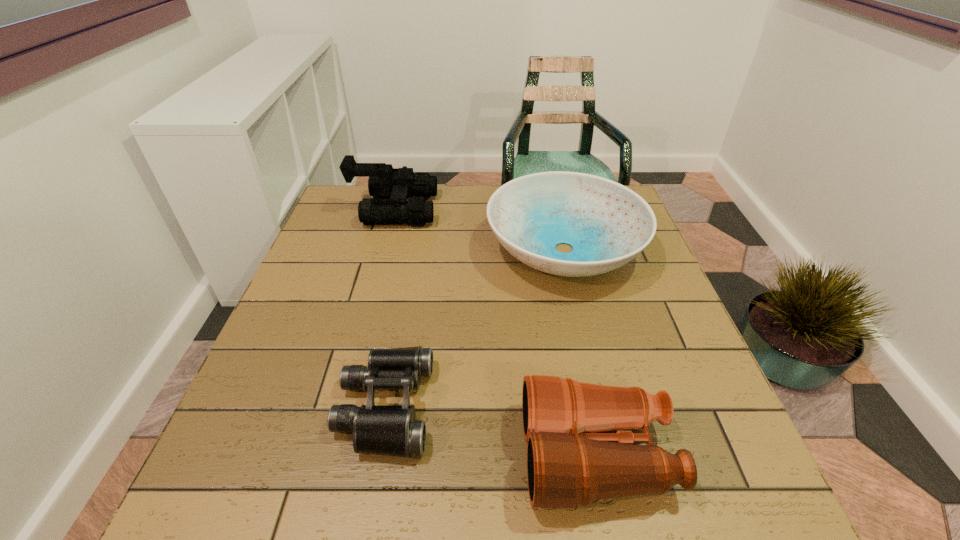
Locate an element on the screen. free spot that satisfies the following two spatial constraints: 1. on the front lenses of the farthest binoculars; 2. on the left side of the dish is located at coordinates (383, 249).

This screenshot has width=960, height=540. Identify the location of vacant area in the image that satisfies the following two spatial constraints: 1. on the front lenses of the dish; 2. on the left side of the tallest object. (x=383, y=249).

I want to click on free space that satisfies the following two spatial constraints: 1. on the front lenses of the farthest binoculars; 2. on the left side of the dish, so click(383, 249).